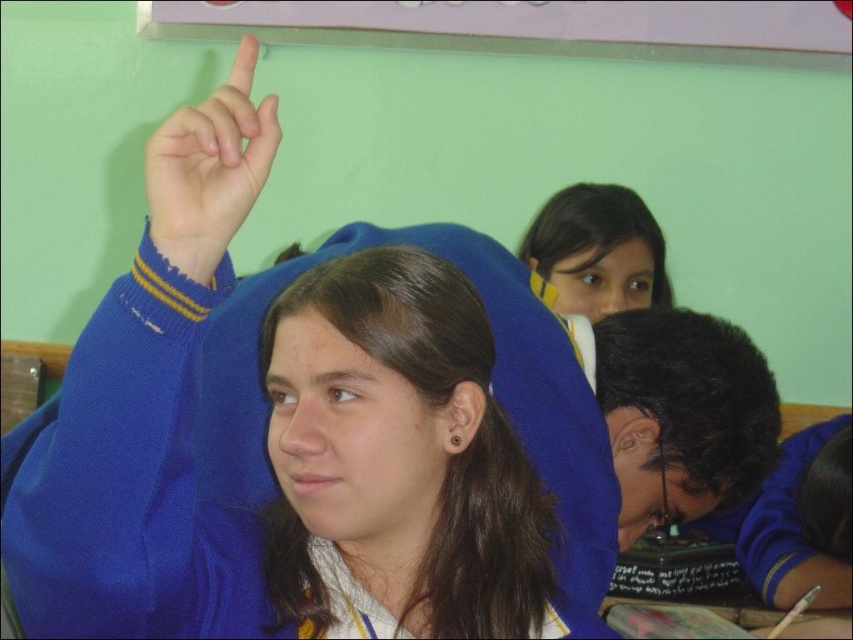
Question: In this image, where is blue knitted sweater at upper center located relative to matte blue sweater at upper center?

Choices:
 (A) below
 (B) above

Answer: (A)

Question: Which point appears farthest from the camera in this image?

Choices:
 (A) (614, 468)
 (B) (397, 518)
 (C) (537, 456)

Answer: (A)

Question: Which point is farther to the camera?

Choices:
 (A) (294, 333)
 (B) (247, 429)
 (C) (242, 204)
 (D) (665, 340)

Answer: (D)

Question: Among these objects, which one is nearest to the camera?

Choices:
 (A) matte blue hand at upper left
 (B) matte blue sweater at upper center
 (C) black matte hair at lower right

Answer: (A)

Question: Can you confirm if blue knitted sweater at upper center is thinner than black matte hair at lower right?

Choices:
 (A) yes
 (B) no

Answer: (B)

Question: From the image, what is the correct spatial relationship of blue knitted sweater at upper center in relation to matte blue hand at upper left?

Choices:
 (A) left
 (B) right

Answer: (B)